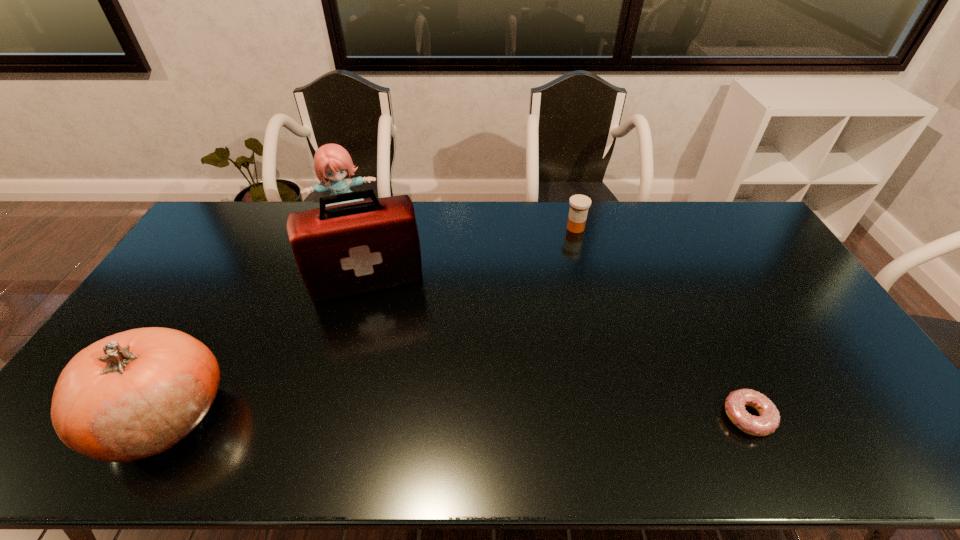
Locate an element on the screen. The width and height of the screenshot is (960, 540). pumpkin is located at coordinates (135, 394).

This screenshot has width=960, height=540. In order to click on the rightmost object in this screenshot , I will do `click(768, 421)`.

This screenshot has width=960, height=540. Identify the location of the shortest object. (768, 421).

I want to click on medicine, so click(x=579, y=204).

The width and height of the screenshot is (960, 540). I want to click on the second object from right to left, so click(x=579, y=204).

I want to click on the first aid kit, so click(342, 250).

The height and width of the screenshot is (540, 960). What are the coordinates of `doll` in the screenshot? It's located at (331, 161).

Identify the location of blank area located 0.200m on the back of the pumpkin. (224, 309).

Where is `free space located on the back of the rightmost object`? free space located on the back of the rightmost object is located at coordinates (708, 333).

Image resolution: width=960 pixels, height=540 pixels. In order to click on free space located 0.340m on the label of the fourth object from left to right in this screenshot , I will do `click(556, 299)`.